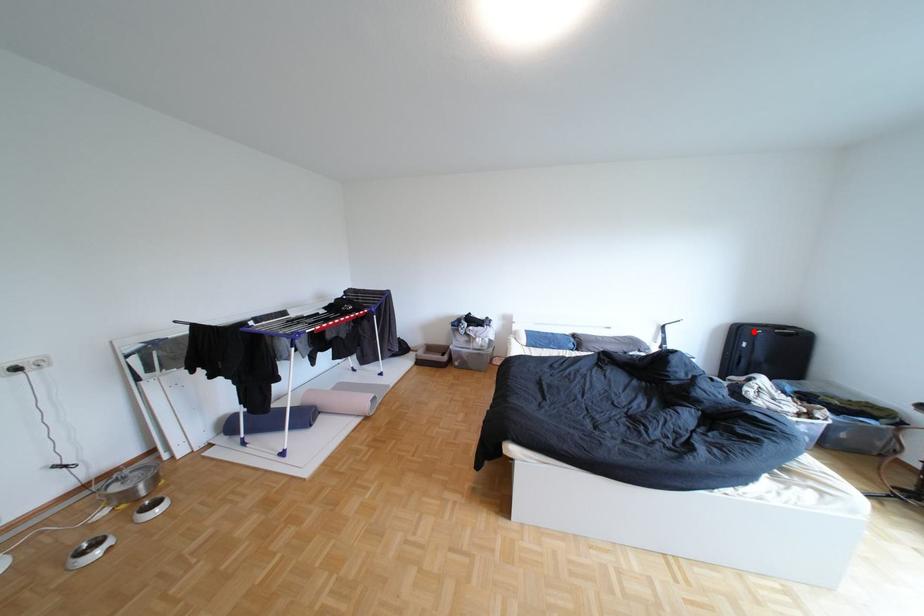
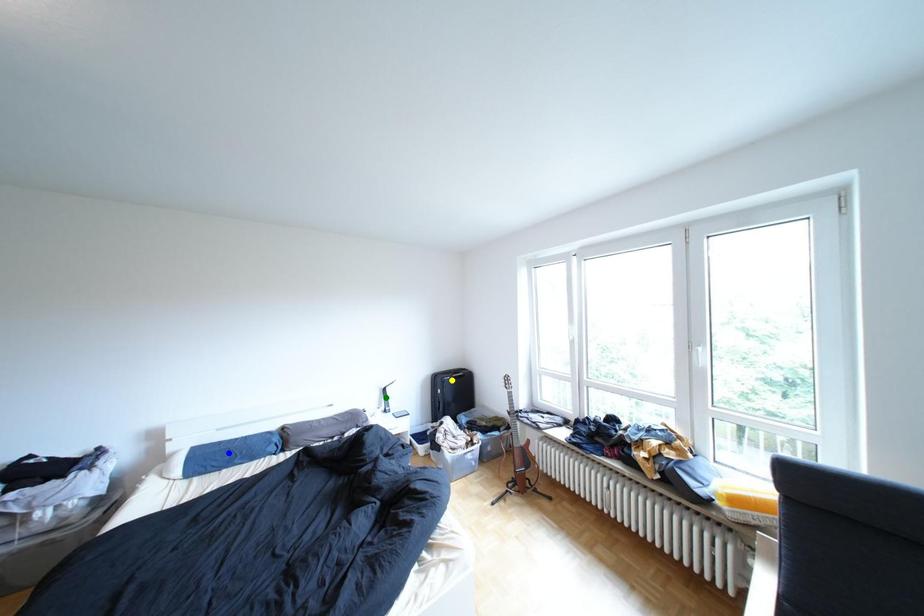
Question: I am providing you with two images of the same scene from different viewpoints. A red point is marked on the first image. You are given multiple points on the second image. Which spot in image 2 lines up with the point in image 1?

Choices:
 (A) yellow point
 (B) blue point
 (C) green point

Answer: (A)